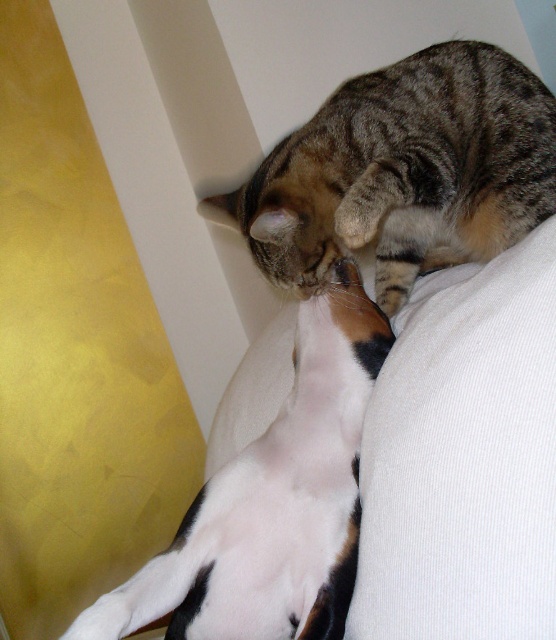
Which of these two, tabby fur cat at upper center or white fur cat at center, stands shorter?

tabby fur cat at upper center is shorter.

Consider the image. Can you confirm if tabby fur cat at upper center is bigger than white fur cat at center?

Indeed, tabby fur cat at upper center has a larger size compared to white fur cat at center.

Between point (317, 163) and point (147, 614), which one is positioned in front?

Point (147, 614) is more forward.

Identify the location of tabby fur cat at upper center. (404, 172).